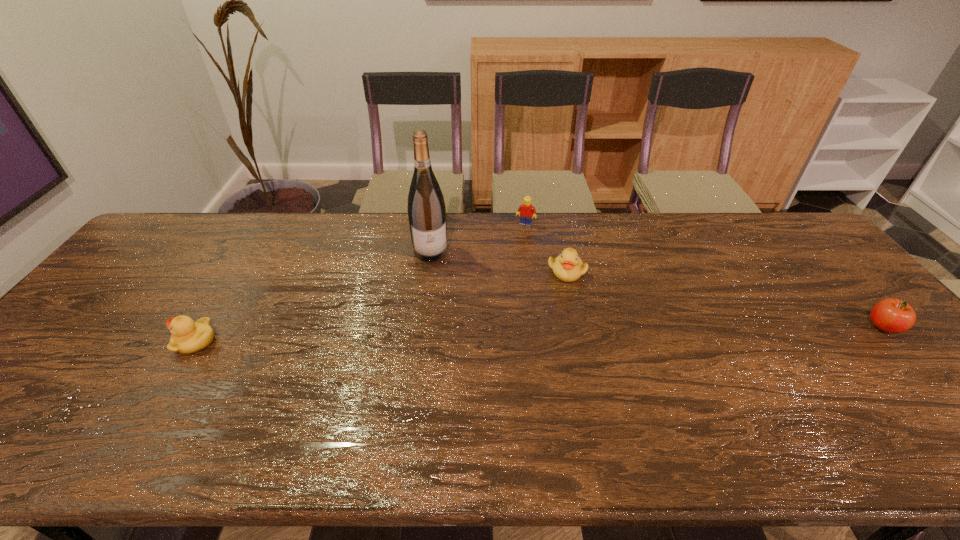
Where is `vacant point located between the left duckling and the fourth object from left to right`? vacant point located between the left duckling and the fourth object from left to right is located at coordinates (381, 306).

Locate an element on the screen. The image size is (960, 540). vacant region between the apple and the tallest object is located at coordinates (657, 289).

Where is `free space between the rightmost object and the nearer duckling`? The height and width of the screenshot is (540, 960). free space between the rightmost object and the nearer duckling is located at coordinates (540, 334).

At what (x,y) coordinates should I click in order to perform the action: click on unoccupied area between the left duckling and the second object from right to left. Please return your answer as a coordinate pair (x, y). The image size is (960, 540). Looking at the image, I should click on (381, 306).

At what (x,y) coordinates should I click in order to perform the action: click on vacant point located between the third object from right to left and the rightmost object. Please return your answer as a coordinate pair (x, y). Looking at the image, I should click on (704, 276).

Where is `free space between the farther duckling and the farthest object`? free space between the farther duckling and the farthest object is located at coordinates (546, 248).

You are a GUI agent. You are given a task and a screenshot of the screen. Output one action in this format:
    pyautogui.click(x=<x>, y=<y>)
    Task: Click on the empty location between the leftmost object and the tallest object
    
    Given the screenshot: What is the action you would take?
    pos(313,296)

This screenshot has width=960, height=540. I want to click on unoccupied position between the wine bottle and the left duckling, so click(x=313, y=296).

You are a GUI agent. You are given a task and a screenshot of the screen. Output one action in this format:
    pyautogui.click(x=<x>, y=<y>)
    Task: Click on the vacant region between the apple and the second object from left to right
    
    Given the screenshot: What is the action you would take?
    pyautogui.click(x=657, y=289)

Where is `free spot between the rightmost object and the nearer duckling`? The width and height of the screenshot is (960, 540). free spot between the rightmost object and the nearer duckling is located at coordinates pos(540,334).